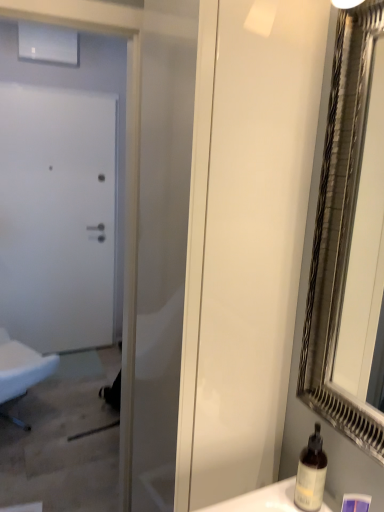
Find the location of a particular element. This screenshot has height=512, width=384. vacant region above white matte door at left (from a real-world perspective) is located at coordinates 49,93.